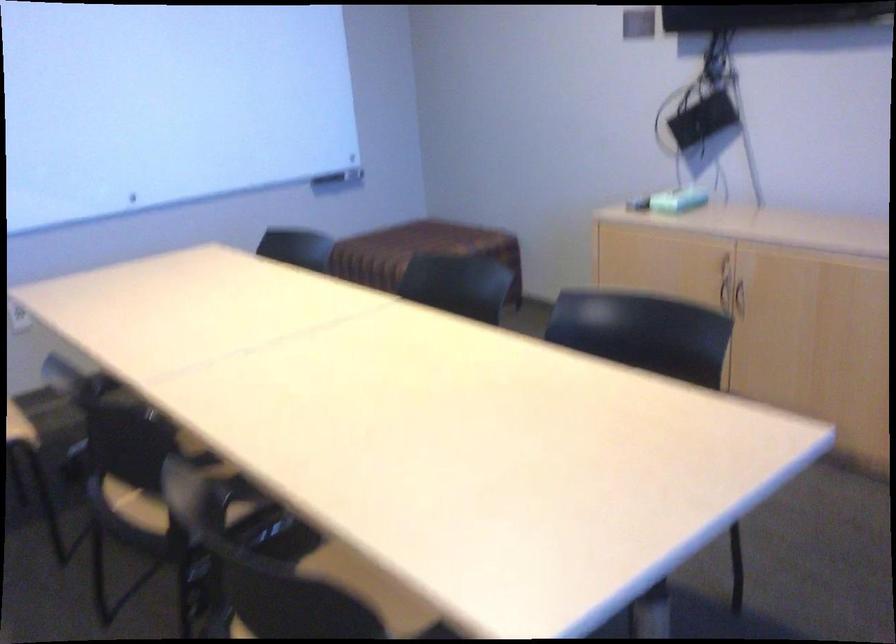
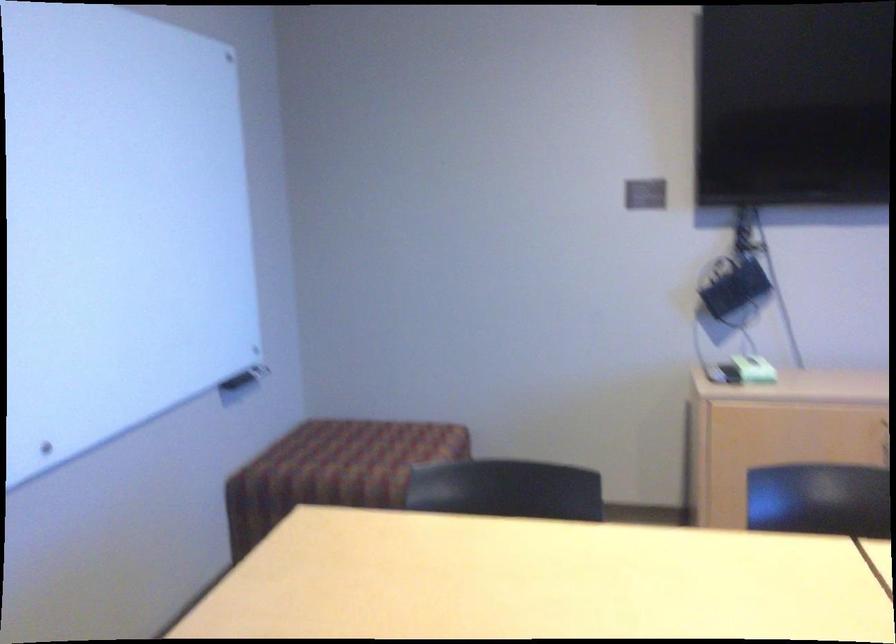
Where in the second image is the point corresponding to pixel 708 118 from the first image?

(734, 289)